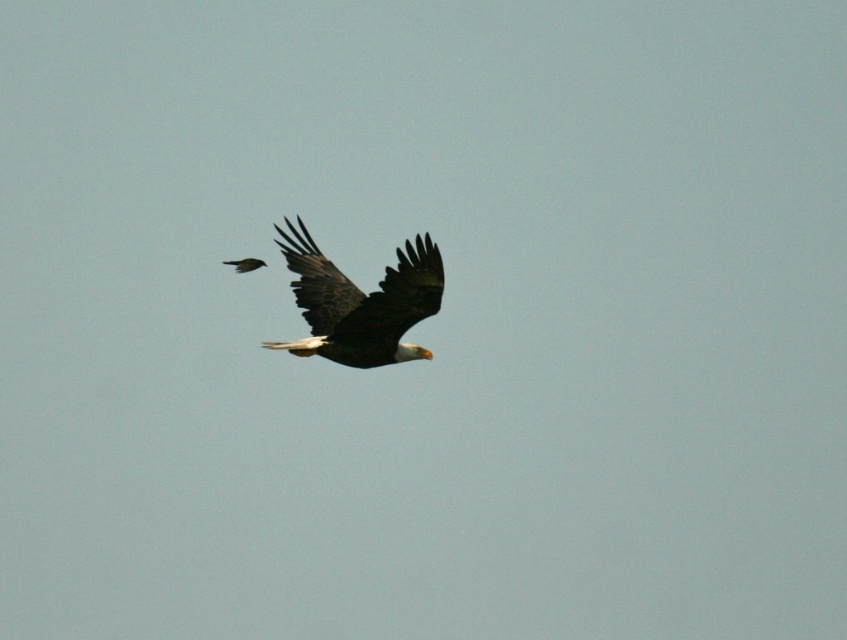
Can you confirm if white-feathered bald eagle at center is taller than dark brown feathers at center?

Yes, white-feathered bald eagle at center is taller than dark brown feathers at center.

Does white-feathered bald eagle at center lie in front of dark brown feathers at center?

Yes, white-feathered bald eagle at center is in front of dark brown feathers at center.

Does point (303, 304) lie behind point (227, 260)?

No, (303, 304) is in front of (227, 260).

Where is `white-feathered bald eagle at center`? white-feathered bald eagle at center is located at coordinates (361, 304).